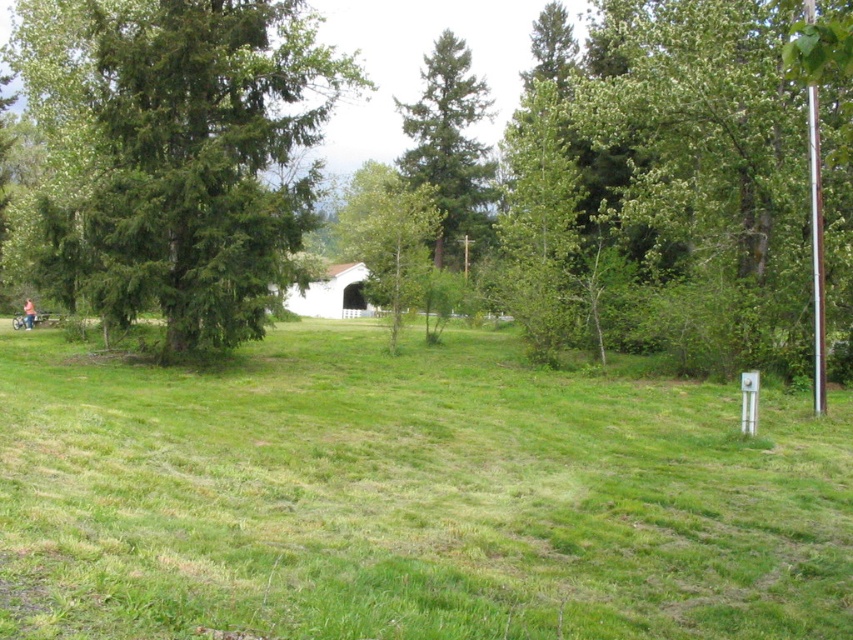
Measure the distance between green grassy field at center and green matte tree at center.

They are 143.14 feet apart.

Is point (701, 541) positioned before point (460, 112)?

Yes, point (701, 541) is in front of point (460, 112).

Locate an element on the screen. This screenshot has height=640, width=853. green grassy field at center is located at coordinates (409, 497).

Between green grassy field at center and white painted wood hut at center, which one has more height?

With more height is white painted wood hut at center.

Is green grassy field at center shorter than white painted wood hut at center?

Yes.

Who is more forward, (579, 433) or (347, 285)?

Point (579, 433)

You are a GUI agent. You are given a task and a screenshot of the screen. Output one action in this format:
    pyautogui.click(x=<x>, y=<y>)
    Task: Click on the green grassy field at center
    Image resolution: width=853 pixels, height=640 pixels.
    Given the screenshot: What is the action you would take?
    pyautogui.click(x=409, y=497)

Describe the element at coordinates (173, 156) in the screenshot. The image size is (853, 640). I see `green matte tree at left` at that location.

Between point (202, 120) and point (32, 301), which one is positioned behind?

The point (32, 301) is more distant.

Locate an element on the screen. This screenshot has width=853, height=640. green matte tree at left is located at coordinates (173, 156).